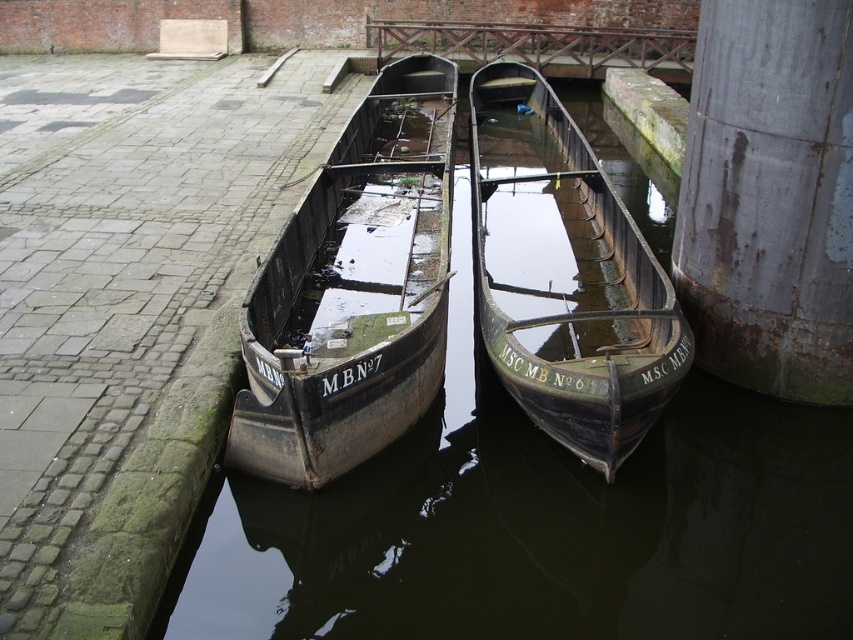
Question: Can you confirm if rusty metal pillar at right is wider than green wooden boat at center?

Choices:
 (A) yes
 (B) no

Answer: (B)

Question: Which object is positioned farthest from the dark brown water at center?

Choices:
 (A) rusty metal boat at center
 (B) green wooden boat at center
 (C) rusty metal pillar at right

Answer: (A)

Question: Can you confirm if rusty metal boat at center is positioned to the right of rusty metal pillar at right?

Choices:
 (A) no
 (B) yes

Answer: (A)

Question: Is rusty metal pillar at right wider than green wooden boat at center?

Choices:
 (A) no
 (B) yes

Answer: (A)

Question: Which point is farther to the camera?

Choices:
 (A) (704, 333)
 (B) (585, 321)
 (C) (285, 435)
 (D) (560, 461)

Answer: (B)

Question: Estimate the real-world distances between objects in this image. Which object is farther from the rusty metal pillar at right?

Choices:
 (A) green wooden boat at center
 (B) dark brown water at center

Answer: (A)